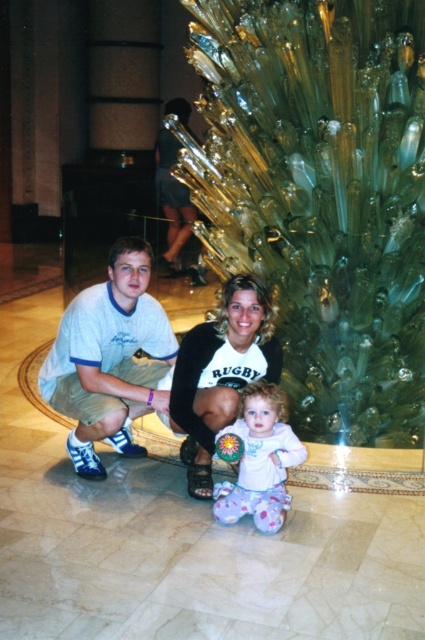
Question: Which point is closer to the camera?

Choices:
 (A) (119, 310)
 (B) (254, 384)

Answer: (B)

Question: Does white cotton shirt at center come behind fluffy white onesie at center?

Choices:
 (A) yes
 (B) no

Answer: (A)

Question: Does white cotton shirt at center come in front of white matte sweater at center?

Choices:
 (A) no
 (B) yes

Answer: (A)

Question: Considering the real-world distances, which object is closest to the white cotton shirt at center?

Choices:
 (A) fluffy white onesie at center
 (B) white matte sweater at center

Answer: (B)

Question: Among these points, which one is farthest from the camera?

Choices:
 (A) (241, 285)
 (B) (246, 428)

Answer: (A)

Question: Considering the relative positions of white cotton shirt at center and white matte sweater at center in the image provided, where is white cotton shirt at center located with respect to white matte sweater at center?

Choices:
 (A) right
 (B) left

Answer: (B)